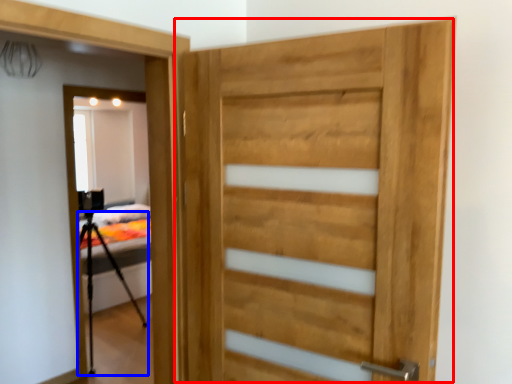
Question: Which of the following is the closest to the observer, door (highlighted by a red box) or tripod (highlighted by a blue box)?

Choices:
 (A) door
 (B) tripod

Answer: (A)